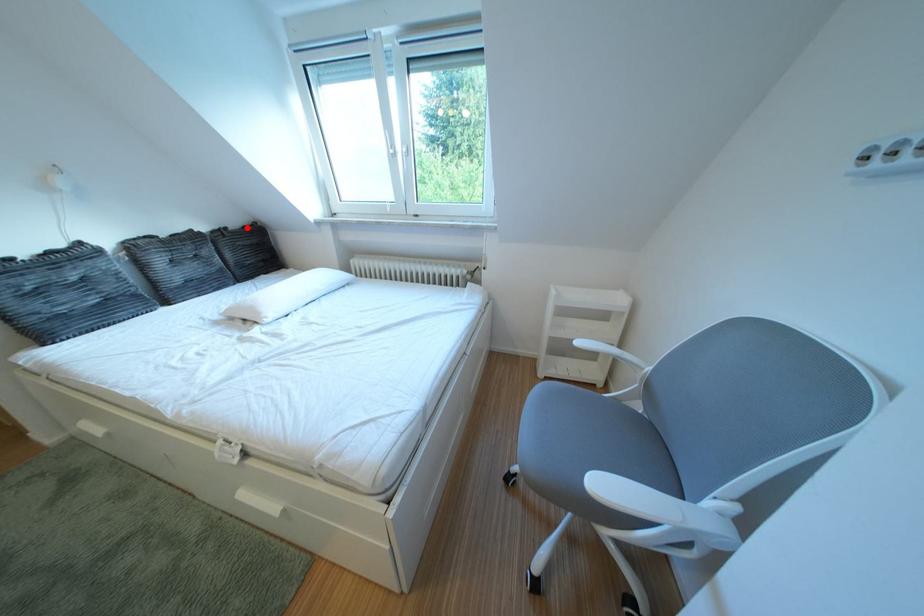
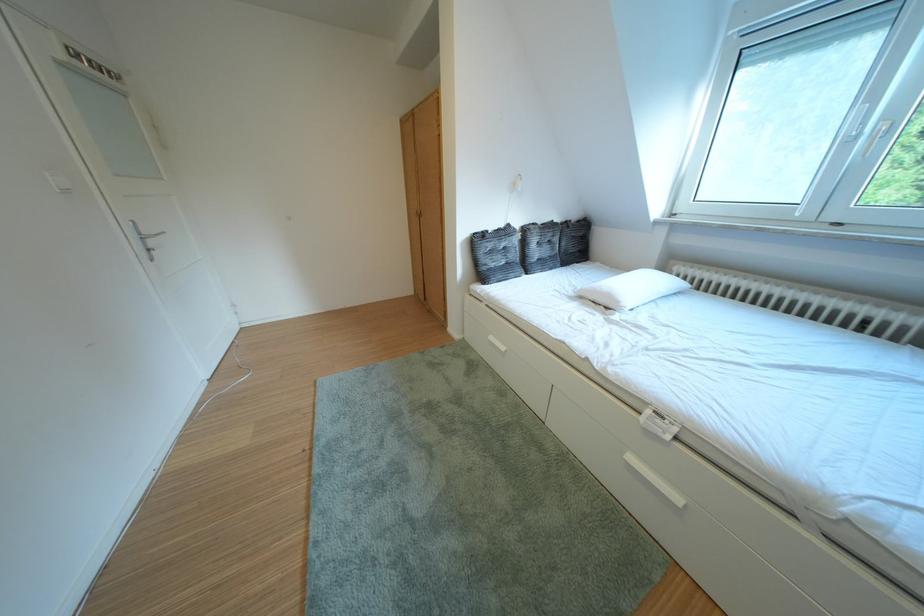
Find the pixel in the second image that matches the highlighted location in the first image.

(588, 222)